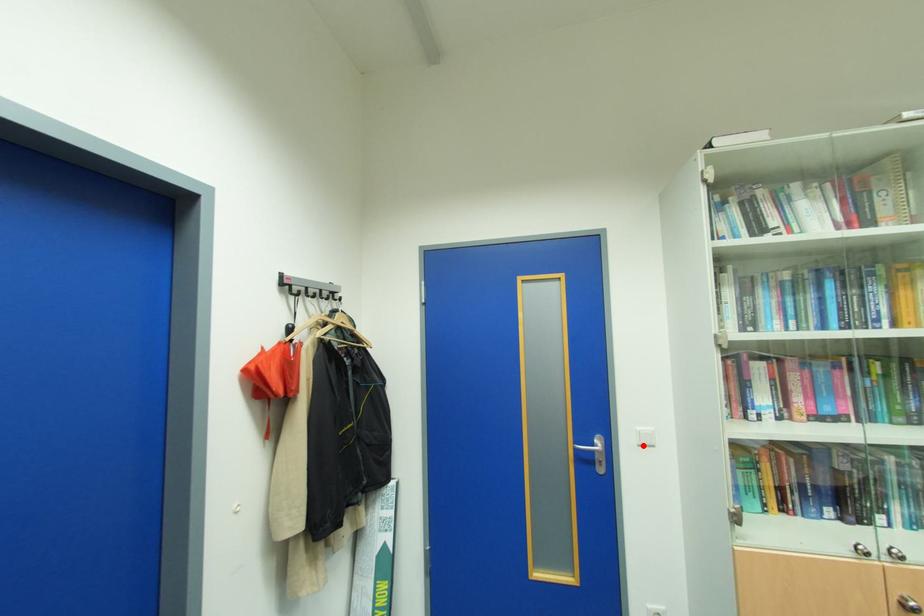
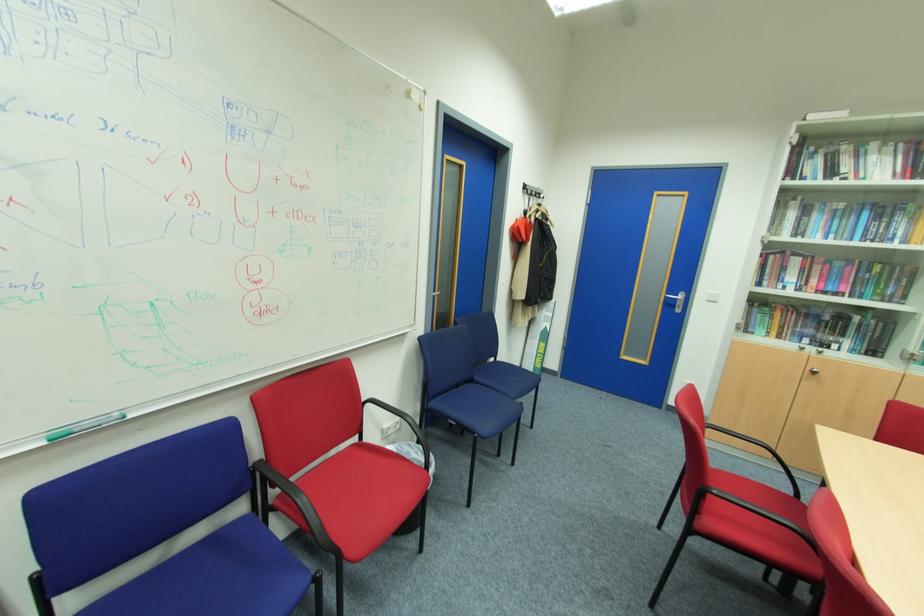
Question: I am providing you with two images of the same scene from different viewpoints. A red point is shown in image1. For the corresponding object point in image2, is it positioned nearer or farther from the camera?

Choices:
 (A) Nearer
 (B) Farther

Answer: (A)